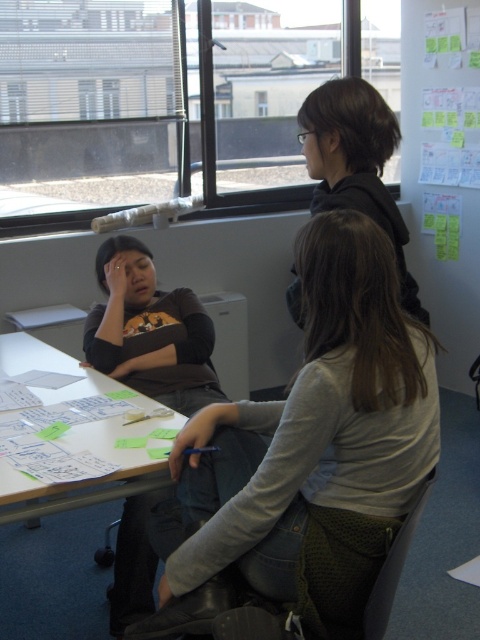
Question: Which point is closer to the camera taking this photo?

Choices:
 (A) 146,404
 (B) 214,337
 (C) 253,108
 (D) 363,554

Answer: (D)

Question: Can you confirm if transparent glass window at upper left is positioned to the left of matte brown shirt at center?

Choices:
 (A) no
 (B) yes

Answer: (B)

Question: Which of the following is the closest to the observer?

Choices:
 (A) (202, 80)
 (B) (166, 472)
 (C) (310, 547)

Answer: (C)

Question: Does transparent glass window at upper left appear over matte brown shirt at center?

Choices:
 (A) no
 (B) yes

Answer: (B)

Question: Can you confirm if gray fabric jacket at center is positioned to the left of matte brown shirt at center?

Choices:
 (A) no
 (B) yes

Answer: (A)

Question: Which object is farther from the camera taking this photo?

Choices:
 (A) transparent glass window at upper left
 (B) transparent glass window at upper center
 (C) white paper at center
 (D) gray fabric jacket at center

Answer: (B)